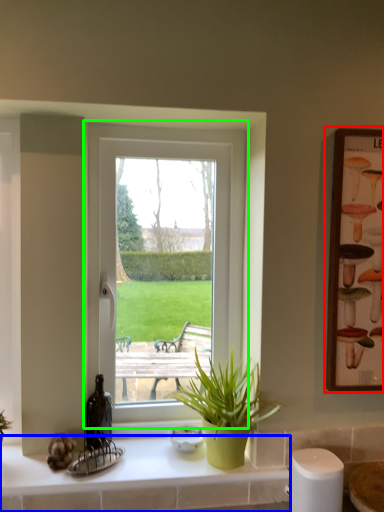
Question: Which is farther away from picture frame (highlighted by a red box)? counter top (highlighted by a blue box) or window (highlighted by a green box)?

Choices:
 (A) counter top
 (B) window

Answer: (A)